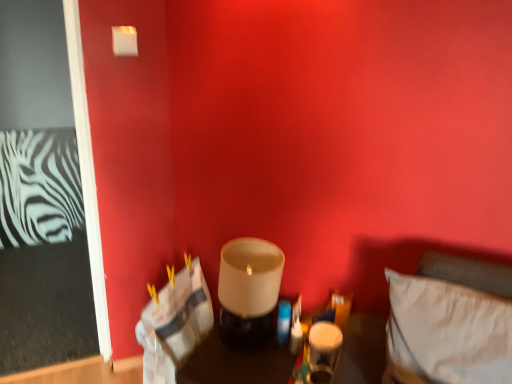
Question: Is white fabric pillow at lower right at the right side of matte white glass at lower center, marked as the second candle holder in a left-to-right arrangement?

Choices:
 (A) yes
 (B) no

Answer: (A)

Question: Can you confirm if white fabric pillow at lower right is wider than matte white glass at lower center, the first candle holder in the right-to-left sequence?

Choices:
 (A) no
 (B) yes

Answer: (B)

Question: Is white fabric pillow at lower right positioned with its back to matte white glass at lower center, marked as the second candle holder in a left-to-right arrangement?

Choices:
 (A) yes
 (B) no

Answer: (B)

Question: Does white fabric pillow at lower right appear on the left side of matte white glass at lower center, marked as the second candle holder in a left-to-right arrangement?

Choices:
 (A) yes
 (B) no

Answer: (B)

Question: Is white fabric pillow at lower right not inside matte white glass at lower center, the first candle holder in the right-to-left sequence?

Choices:
 (A) yes
 (B) no

Answer: (A)

Question: Is white fabric pillow at lower right next to matte white glass at lower center, marked as the second candle holder in a left-to-right arrangement, and touching it?

Choices:
 (A) no
 (B) yes

Answer: (A)

Question: From a real-world perspective, is translucent glass candle holder at center below matte white glass at center, placed as the first candle holder when sorted from left to right?

Choices:
 (A) no
 (B) yes

Answer: (B)

Question: Is translucent glass candle holder at center further to the viewer compared to matte white glass at center, marked as the second candle holder in a right-to-left arrangement?

Choices:
 (A) no
 (B) yes

Answer: (A)

Question: Is translucent glass candle holder at center facing towards matte white glass at center, marked as the second candle holder in a right-to-left arrangement?

Choices:
 (A) yes
 (B) no

Answer: (B)

Question: From the image's perspective, is translucent glass candle holder at center over matte white glass at center, marked as the second candle holder in a right-to-left arrangement?

Choices:
 (A) no
 (B) yes

Answer: (A)

Question: Is translucent glass candle holder at center next to matte white glass at center, placed as the first candle holder when sorted from left to right?

Choices:
 (A) no
 (B) yes

Answer: (A)

Question: Can you confirm if translucent glass candle holder at center is positioned to the left of matte white glass at center, placed as the first candle holder when sorted from left to right?

Choices:
 (A) yes
 (B) no

Answer: (B)

Question: Is translucent glass candle holder at center to the left of matte white glass at lower center, marked as the second candle holder in a left-to-right arrangement, from the viewer's perspective?

Choices:
 (A) yes
 (B) no

Answer: (A)